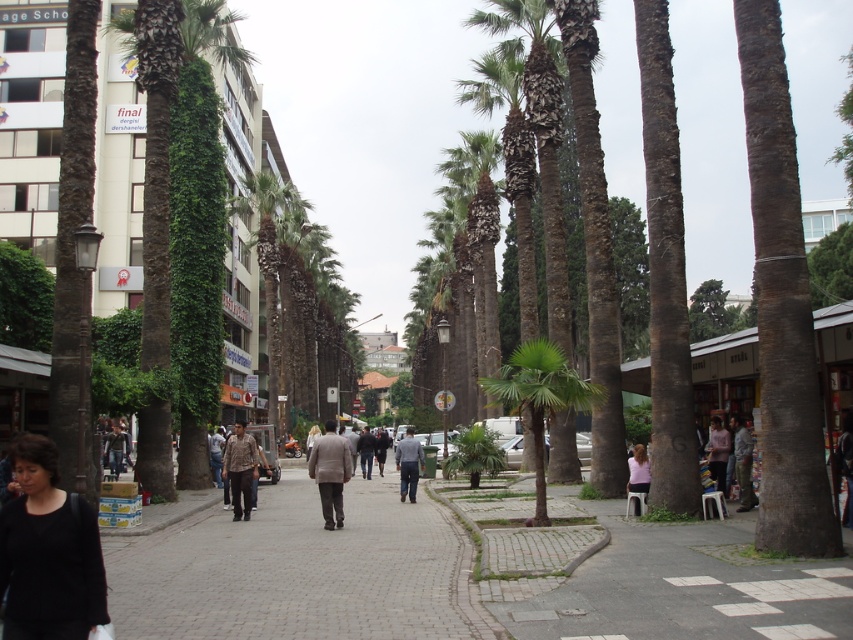
Question: Does brown textured shirt at center have a lesser width compared to pink fabric at center?

Choices:
 (A) yes
 (B) no

Answer: (B)

Question: Which of these objects is positioned farthest from the dark brown leather jacket at center?

Choices:
 (A) camouflage pants at center
 (B) brown rough textured tree at center

Answer: (B)

Question: Which point is farther to the camera?

Choices:
 (A) (775, 368)
 (B) (364, 474)
 (C) (54, 476)
 (D) (538, 461)

Answer: (B)

Question: Which point is farther to the camera?

Choices:
 (A) brown textured shirt at center
 (B) green leafy palm tree at center
 (C) brick paved sidewalk at center
 (D) light brown fabric jacket at center

Answer: (A)

Question: In this image, where is paved stone sidewalk at center located relative to pink fabric at center?

Choices:
 (A) below
 (B) above

Answer: (A)

Question: Observing the image, what is the correct spatial positioning of pink fabric at center in reference to dark gray suit at center?

Choices:
 (A) left
 (B) right

Answer: (B)